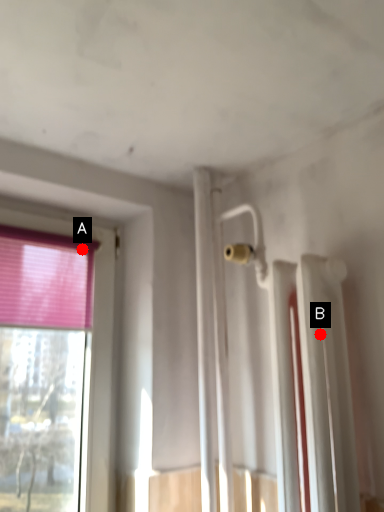
Question: Two points are circled on the image, labeled by A and B beside each circle. Which point is closer to the camera?

Choices:
 (A) A is closer
 (B) B is closer

Answer: (B)